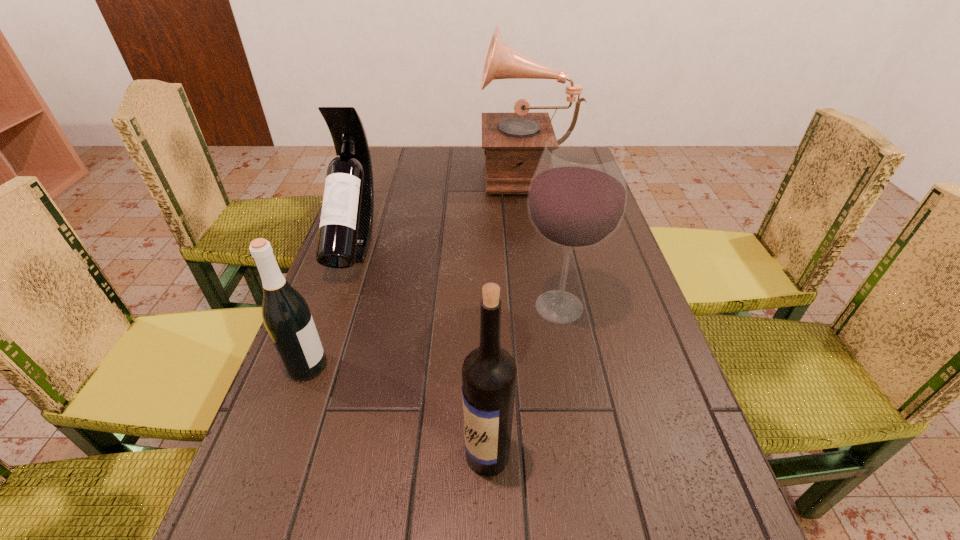
What are the coordinates of `free spot between the fourth farthest object and the nearest object` in the screenshot? It's located at (397, 410).

At what (x,y) coordinates should I click in order to perform the action: click on vacant point located between the nearest object and the record player. Please return your answer as a coordinate pair (x, y). The height and width of the screenshot is (540, 960). Looking at the image, I should click on (507, 313).

Find the location of a particular element. The width and height of the screenshot is (960, 540). object that is the fourth closest to the record player is located at coordinates (489, 372).

Identify which object is located as the third nearest to the farthest object. Please provide its 2D coordinates. Your answer should be formatted as a tuple, i.e. [(x, y)], where the tuple contains the x and y coordinates of a point satisfying the conditions above.

[(286, 315)]

Where is `the closest wine bottle relative to the second farthest wine bottle`? This screenshot has height=540, width=960. the closest wine bottle relative to the second farthest wine bottle is located at coordinates (345, 231).

Where is `wine bottle identified as the second closest to the farthest object`? This screenshot has width=960, height=540. wine bottle identified as the second closest to the farthest object is located at coordinates (286, 315).

Image resolution: width=960 pixels, height=540 pixels. I want to click on vacant region that satisfies the following two spatial constraints: 1. on the horn of the alcohol; 2. on the left side of the record player, so click(x=548, y=307).

Locate an element on the screen. This screenshot has width=960, height=540. free point that satisfies the following two spatial constraints: 1. on the stand of the farthest wine bottle; 2. on the right side of the alcohol is located at coordinates (331, 307).

You are a GUI agent. You are given a task and a screenshot of the screen. Output one action in this format:
    pyautogui.click(x=<x>, y=<y>)
    Task: Click on the free space that satisfies the following two spatial constraints: 1. on the stand of the farthest wine bottle; 2. on the label of the fourth farthest object
    This screenshot has width=960, height=540.
    Given the screenshot: What is the action you would take?
    pyautogui.click(x=310, y=366)

Image resolution: width=960 pixels, height=540 pixels. Find the location of `free space that satisfies the following two spatial constraints: 1. on the back side of the alcohol; 2. on the horn of the record player`. free space that satisfies the following two spatial constraints: 1. on the back side of the alcohol; 2. on the horn of the record player is located at coordinates (533, 171).